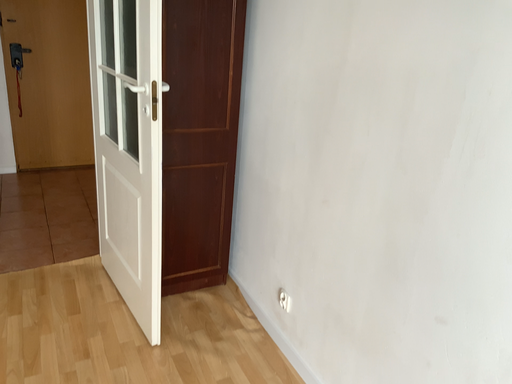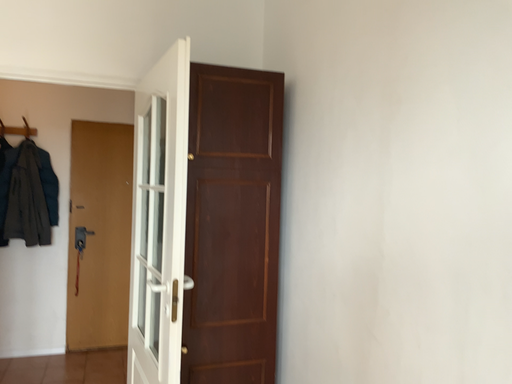
Question: How did the camera likely rotate when shooting the video?

Choices:
 (A) rotated downward
 (B) rotated upward

Answer: (B)